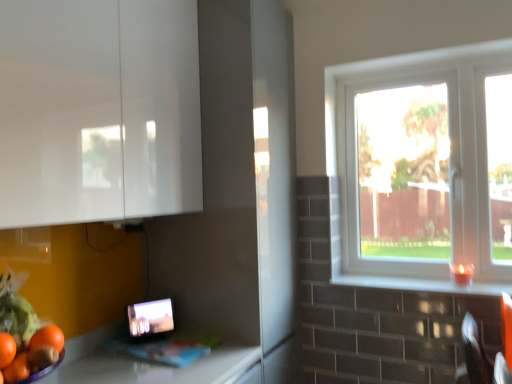
Question: Are white glossy cabinet at upper left and matte black tablet at lower left making contact?

Choices:
 (A) yes
 (B) no

Answer: (B)

Question: Is white glossy cabinet at upper left positioned with its back to matte black tablet at lower left?

Choices:
 (A) no
 (B) yes

Answer: (A)

Question: Is white glossy cabinet at upper left aimed at matte black tablet at lower left?

Choices:
 (A) yes
 (B) no

Answer: (B)

Question: Can you confirm if white glossy cabinet at upper left is smaller than matte black tablet at lower left?

Choices:
 (A) yes
 (B) no

Answer: (B)

Question: Does white glossy cabinet at upper left have a lesser height compared to matte black tablet at lower left?

Choices:
 (A) yes
 (B) no

Answer: (B)

Question: From a real-world perspective, is white glossy cabinet at upper left physically above matte black tablet at lower left?

Choices:
 (A) no
 (B) yes

Answer: (B)

Question: Are matte black tablet at lower left and white plastic window at right beside each other?

Choices:
 (A) yes
 (B) no

Answer: (B)

Question: Are matte black tablet at lower left and white plastic window at right located far from each other?

Choices:
 (A) yes
 (B) no

Answer: (A)

Question: Would you say matte black tablet at lower left is outside white plastic window at right?

Choices:
 (A) no
 (B) yes

Answer: (B)

Question: Can you confirm if matte black tablet at lower left is positioned to the right of white plastic window at right?

Choices:
 (A) no
 (B) yes

Answer: (A)

Question: From a real-world perspective, does matte black tablet at lower left stand above white plastic window at right?

Choices:
 (A) yes
 (B) no

Answer: (B)

Question: From the image's perspective, is matte black tablet at lower left above white plastic window at right?

Choices:
 (A) yes
 (B) no

Answer: (B)

Question: Are white glossy window sill at right and white plastic window at right making contact?

Choices:
 (A) yes
 (B) no

Answer: (B)